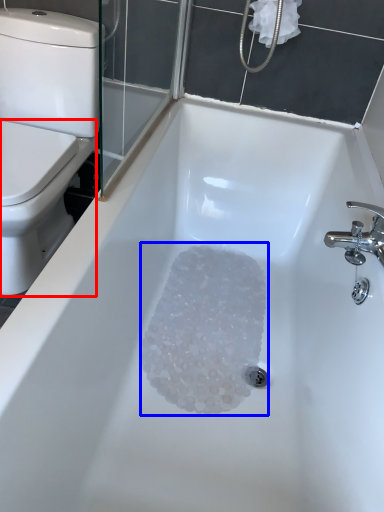
Question: Which of the following is the farthest to the observer, bidet (highlighted by a red box) or crystal (highlighted by a blue box)?

Choices:
 (A) bidet
 (B) crystal

Answer: (B)